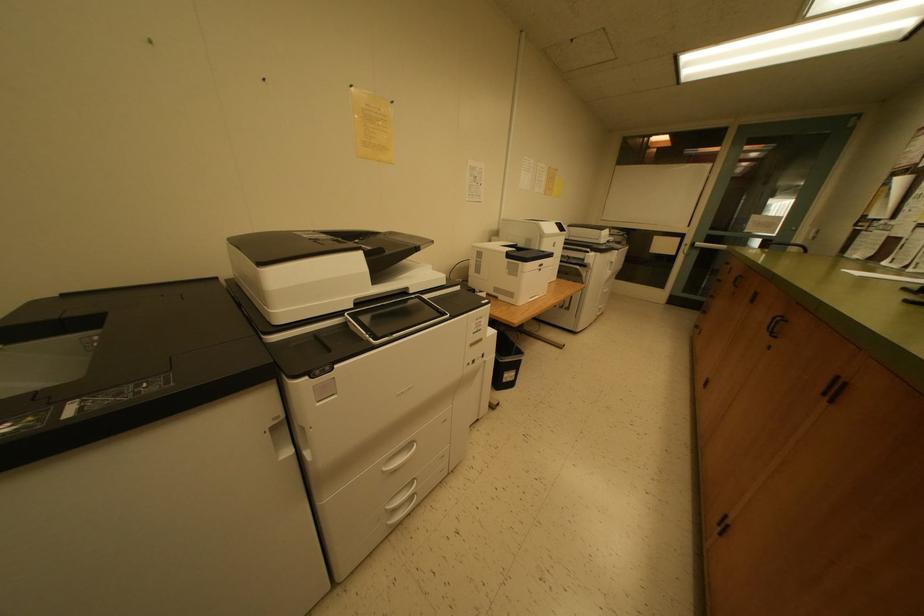
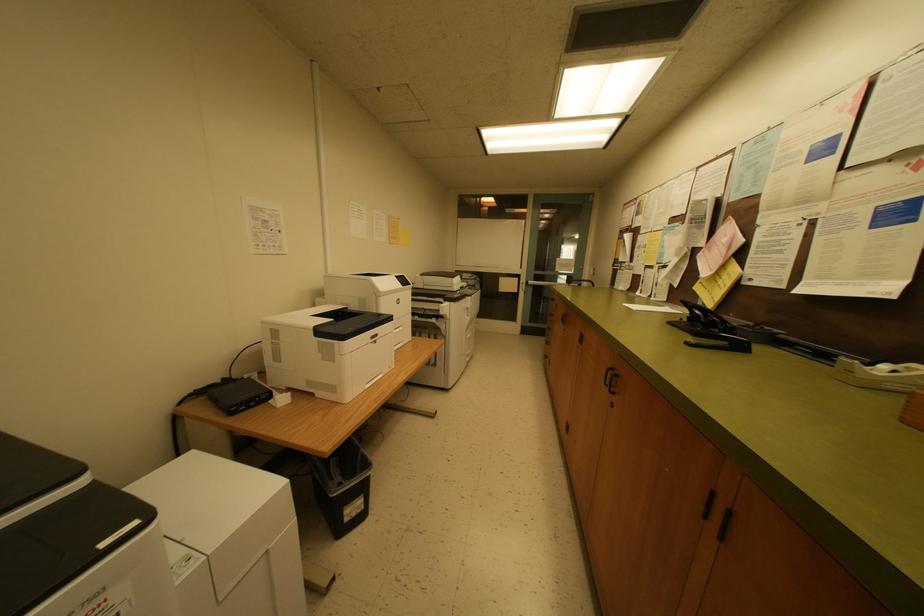
Based on the photo, in a continuous first-person perspective shot, in which direction is the camera moving?

The cameraman walked toward right, forward.